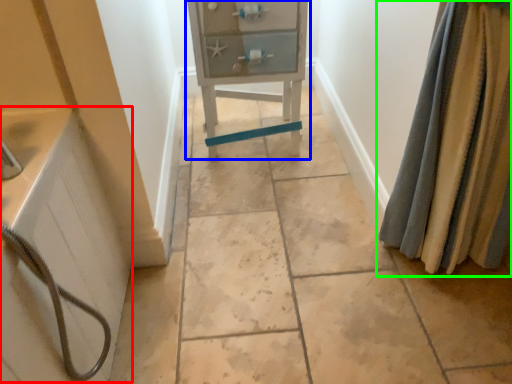
Question: Based on their relative distances, which object is nearer to bath (highlighted by a red box)? Choose from furniture (highlighted by a blue box) and curtain (highlighted by a green box).

Choices:
 (A) furniture
 (B) curtain

Answer: (A)